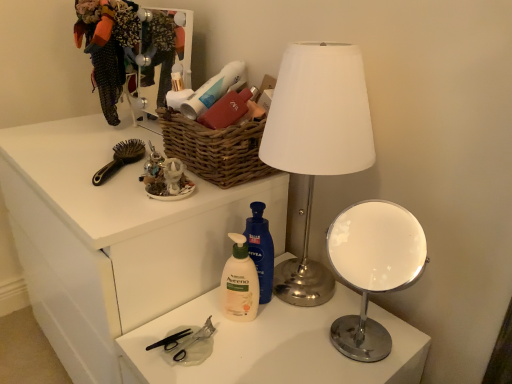
The image size is (512, 384). I want to click on free space in front of black plastic brush at upper left, so click(x=100, y=196).